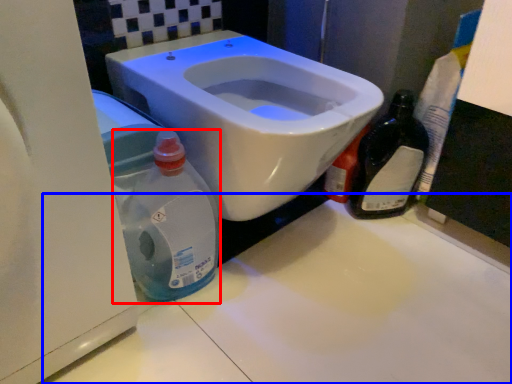
Question: Which object appears farthest to the camera in this image, cleaning product (highlighted by a red box) or counter top (highlighted by a blue box)?

Choices:
 (A) cleaning product
 (B) counter top

Answer: (A)